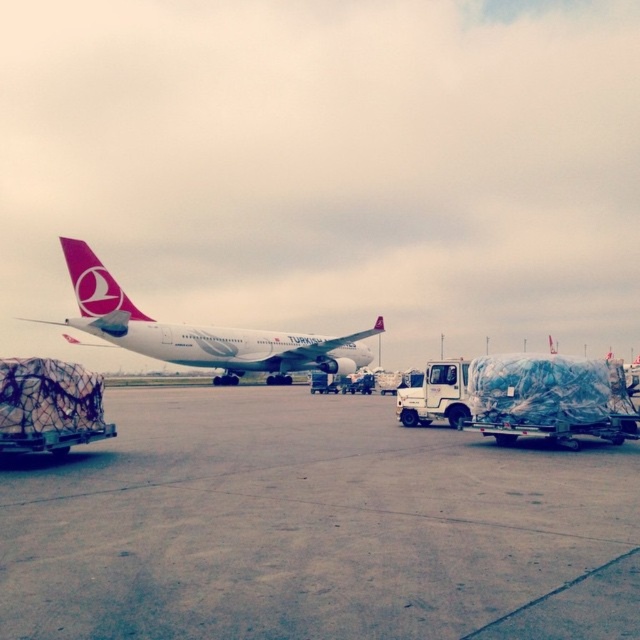
Based on the photo, you are a pilot preparing to taxi the white glossy airplane at center from its current position. The concrete tarmac at center is the only path available. Based on the scene, can the airplane safely navigate the tarmac without risking damage to itself or the surroundings?

The concrete tarmac at center has a lesser width compared to white glossy airplane at center, so the airplane may not safely navigate the tarmac without risking damage to itself or the surroundings due to insufficient width.

Looking at this image, you are standing on the airport tarmac and see two points marked on the ground. The first point is at coordinate point (440,435) and the second point is at coordinate point (68,243). Which point is closer to you?

Point (440,435) is closer to the viewer than point (68,243).